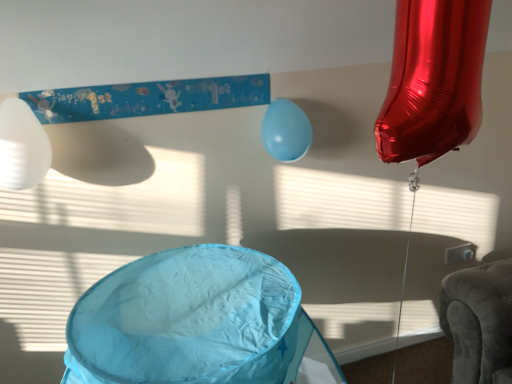
Question: Choose the correct answer: Is white matte balloon at left, which is the 2th balloon in back-to-front order, inside light blue rubber balloon at center, acting as the 2th balloon starting from the front, or outside it?

Choices:
 (A) outside
 (B) inside

Answer: (A)

Question: Considering the positions of white matte balloon at left, the 1th balloon in the left-to-right sequence, and light blue rubber balloon at center, positioned as the 1th balloon in back-to-front order, in the image, is white matte balloon at left, the 1th balloon in the left-to-right sequence, taller or shorter than light blue rubber balloon at center, positioned as the 1th balloon in back-to-front order,?

Choices:
 (A) short
 (B) tall

Answer: (B)

Question: Is white matte balloon at left, positioned as the 1th balloon in front-to-back order, to the left or to the right of light blue rubber balloon at center, acting as the 2th balloon starting from the front, in the image?

Choices:
 (A) right
 (B) left

Answer: (B)

Question: From the image's perspective, relative to white matte balloon at left, positioned as the 1th balloon in front-to-back order, is light blue rubber balloon at center, the first balloon positioned from the right, above or below?

Choices:
 (A) above
 (B) below

Answer: (A)

Question: From a real-world perspective, is light blue rubber balloon at center, the 2th balloon viewed from the left, positioned above or below white matte balloon at left, acting as the 2th balloon starting from the right?

Choices:
 (A) above
 (B) below

Answer: (B)

Question: Would you say light blue rubber balloon at center, positioned as the 1th balloon in back-to-front order, is inside or outside white matte balloon at left, which is the 2th balloon in back-to-front order?

Choices:
 (A) outside
 (B) inside

Answer: (A)

Question: Is light blue rubber balloon at center, acting as the 2th balloon starting from the front, in front of or behind white matte balloon at left, acting as the 2th balloon starting from the right, in the image?

Choices:
 (A) front
 (B) behind

Answer: (B)